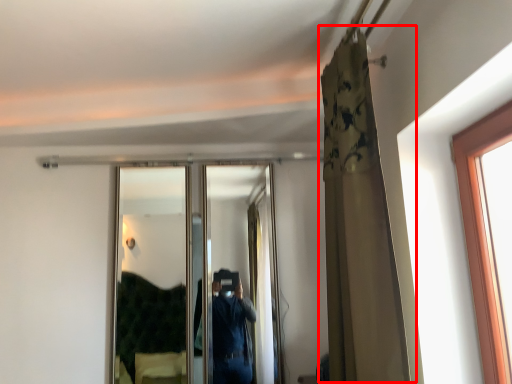
Question: In this image, where is curtain (annotated by the red box) located relative to mirror?

Choices:
 (A) right
 (B) left

Answer: (A)